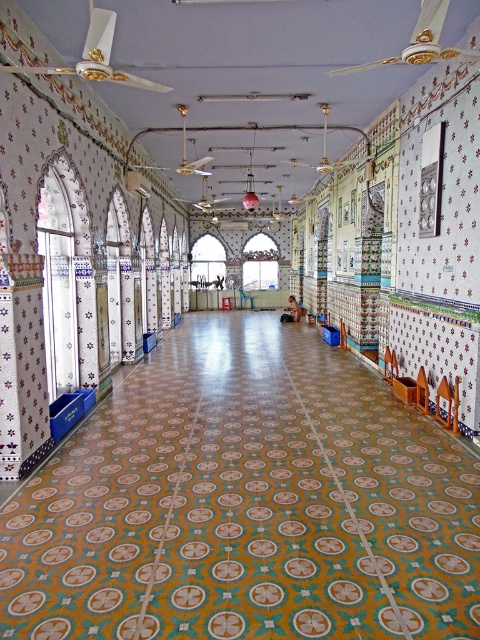
You are standing in the ornately decorated hall and need to sit down. There are two chairs at the center of the hall, a wooden chair at center and a yellow plastic chair at center. Which chair is positioned lower to the ground?

The wooden chair at center is positioned lower to the ground because it is below the yellow plastic chair at center.

You are sitting in the light blue plastic chair at center and want to move to the yellow plastic chair at center. Which direction should you move to reach it?

The yellow plastic chair at center is to the right of the light blue plastic chair at center, so you should move to your right to reach it.